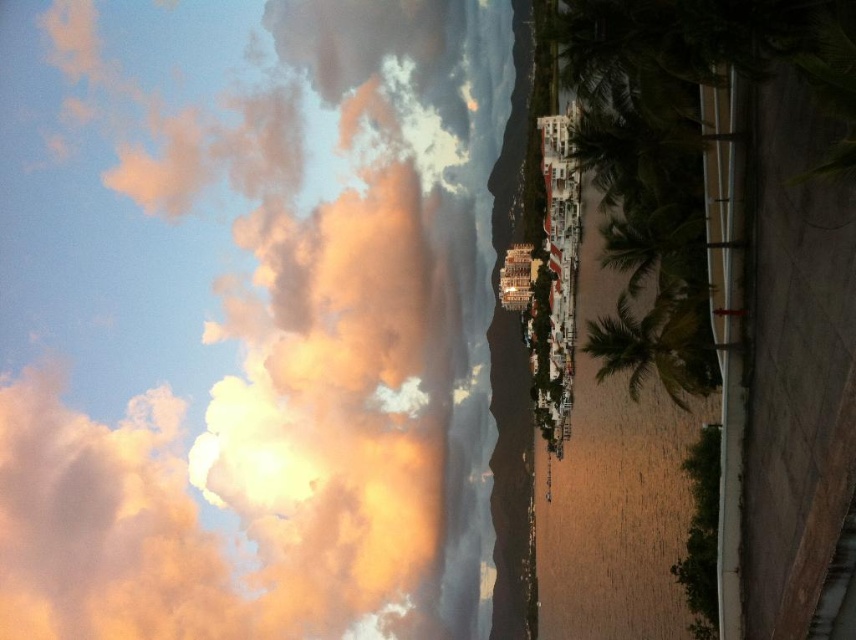
What do you see at coordinates (295, 380) in the screenshot?
I see `cloudy sky at upper left` at bounding box center [295, 380].

How much distance is there between cloudy sky at upper left and green leafy palm tree at lower right?

cloudy sky at upper left and green leafy palm tree at lower right are 177.47 meters apart.

Is point (351, 605) less distant than point (687, 310)?

That is False.

Locate an element on the screen. The image size is (856, 640). cloudy sky at upper left is located at coordinates (295, 380).

Can you confirm if cloudy sky at upper left is bigger than green leafy palm tree at center-right?

Correct, cloudy sky at upper left is larger in size than green leafy palm tree at center-right.

Locate an element on the screen. This screenshot has width=856, height=640. cloudy sky at upper left is located at coordinates (295, 380).

The image size is (856, 640). What are the coordinates of `cloudy sky at upper left` in the screenshot? It's located at (295, 380).

Which is behind, point (705, 339) or point (676, 240)?

The point (705, 339) is more distant.

Is green leafy palm tree at lower right taller than green leafy palm tree at center-right?

Correct, green leafy palm tree at lower right is much taller as green leafy palm tree at center-right.

Where is `green leafy palm tree at lower right`? The image size is (856, 640). green leafy palm tree at lower right is located at coordinates (657, 344).

The width and height of the screenshot is (856, 640). Find the location of `green leafy palm tree at lower right`. green leafy palm tree at lower right is located at coordinates (657, 344).